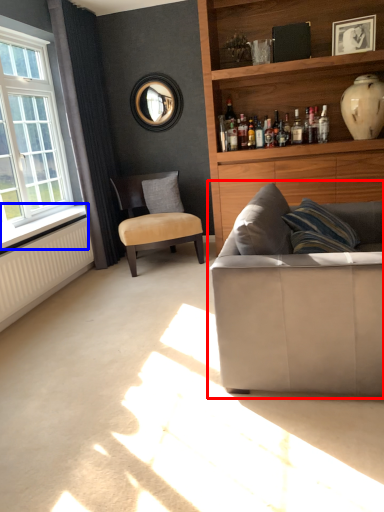
Question: Which of the following is the closest to the observer, studio couch (highlighted by a red box) or window sill (highlighted by a blue box)?

Choices:
 (A) studio couch
 (B) window sill

Answer: (A)